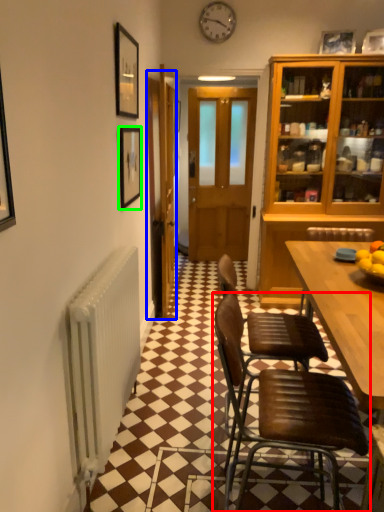
Question: Considering the real-world distances, which object is closest to chair (highlighted by a red box)? door (highlighted by a blue box) or picture frame (highlighted by a green box).

Choices:
 (A) door
 (B) picture frame

Answer: (B)